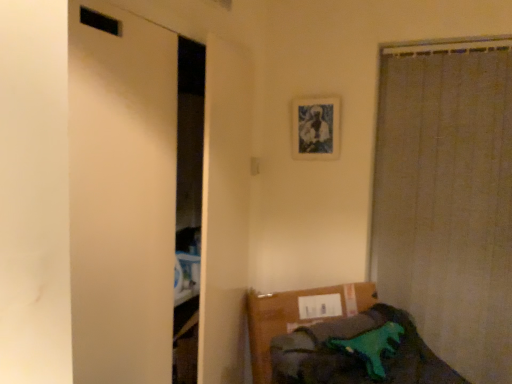
Question: In terms of size, does beige textured curtain at right appear bigger or smaller than green plastic toy dinosaur at lower right?

Choices:
 (A) big
 (B) small

Answer: (B)

Question: From a real-world perspective, relative to green plastic toy dinosaur at lower right, is beige textured curtain at right vertically above or below?

Choices:
 (A) above
 (B) below

Answer: (A)

Question: Which of these objects is positioned farthest from the green plastic toy dinosaur at lower right?

Choices:
 (A) blue textured fabric picture frame at upper center
 (B) beige textured curtain at right

Answer: (A)

Question: Which is nearer to the green plastic toy dinosaur at lower right?

Choices:
 (A) blue textured fabric picture frame at upper center
 (B) beige textured curtain at right

Answer: (B)